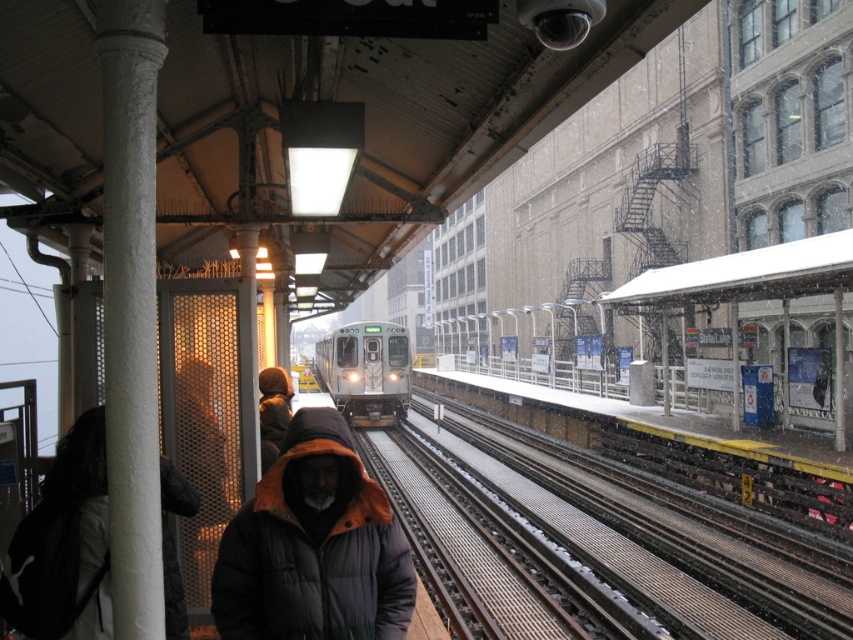
Is the position of silver metallic train at center more distant than that of brown leather jacket at center?

Yes, it is behind brown leather jacket at center.

Does silver metallic train at center appear over brown leather jacket at center?

No.

Who is more distant from viewer, [398,362] or [289,410]?

Point [398,362]

Locate an element on the screen. Image resolution: width=853 pixels, height=640 pixels. silver metallic train at center is located at coordinates (366, 371).

How distant is dark gray hooded jacket at left from brown leather jacket at center?

The distance of dark gray hooded jacket at left from brown leather jacket at center is 2.42 meters.

Which is below, dark gray hooded jacket at left or brown leather jacket at center?

dark gray hooded jacket at left

Is point (177, 627) more distant than point (281, 372)?

No, (177, 627) is in front of (281, 372).

This screenshot has height=640, width=853. Identify the location of dark gray hooded jacket at left. (64, 545).

Does dark puffy jacket at center appear over silver metallic train at center?

Yes, dark puffy jacket at center is above silver metallic train at center.

Where is `dark puffy jacket at center`? This screenshot has height=640, width=853. dark puffy jacket at center is located at coordinates (314, 547).

Where is `dark puffy jacket at center`? dark puffy jacket at center is located at coordinates (314, 547).